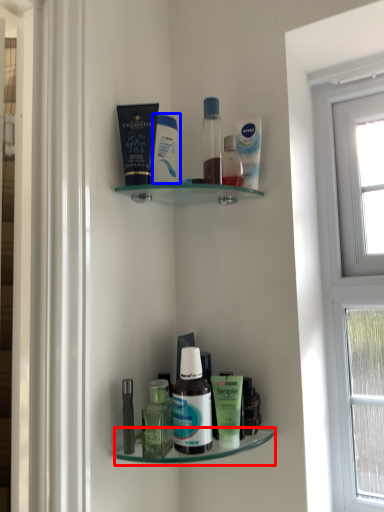
Question: Which object appears closest to the camera in this image, shelf (highlighted by a red box) or cleaning product (highlighted by a blue box)?

Choices:
 (A) shelf
 (B) cleaning product

Answer: (A)